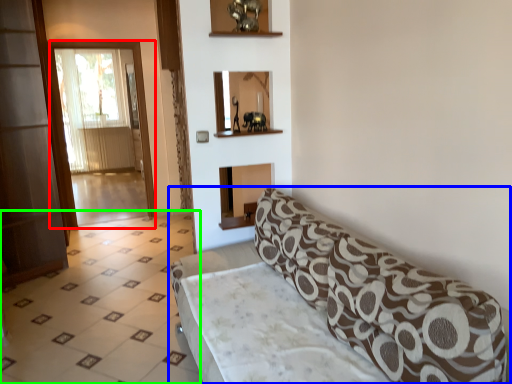
Question: Based on their relative distances, which object is nearer to screen door (highlighted by a red box)? Choose from studio couch (highlighted by a blue box) and tile (highlighted by a green box).

Choices:
 (A) studio couch
 (B) tile

Answer: (B)